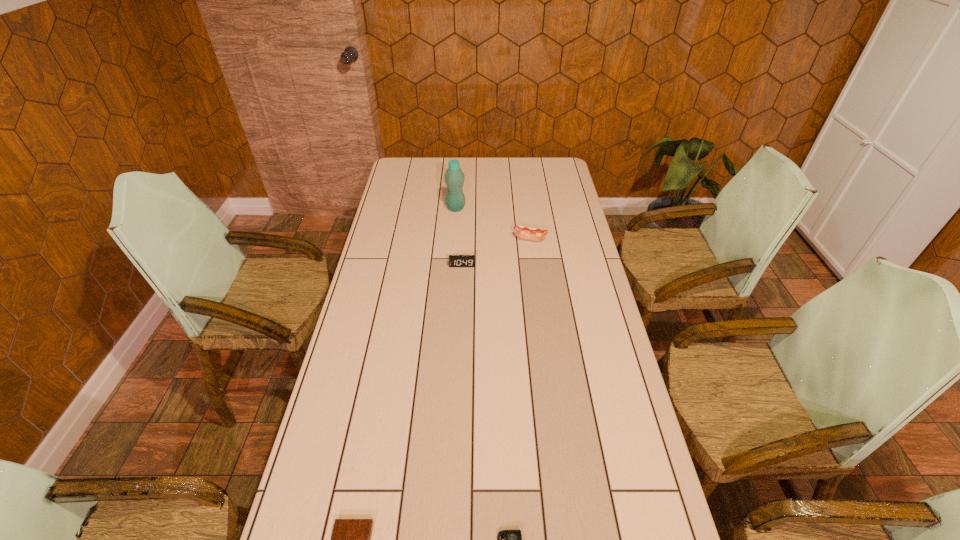
You are a GUI agent. You are given a task and a screenshot of the screen. Output one action in this format:
    pyautogui.click(x=<x>, y=<y>)
    Task: Click on the free space at the far edge
    This screenshot has height=540, width=960.
    Given the screenshot: What is the action you would take?
    pyautogui.click(x=467, y=173)

In the image, there is a desktop. Identify the location of vacant space at the left edge. (391, 237).

In the image, there is a desktop. Where is `vacant space at the right edge`? vacant space at the right edge is located at coordinates (585, 285).

You are a GUI agent. You are given a task and a screenshot of the screen. Output one action in this format:
    pyautogui.click(x=<x>, y=<y>)
    Task: Click on the vacant space at the far left corner of the desktop
    
    Given the screenshot: What is the action you would take?
    pyautogui.click(x=408, y=161)

I want to click on vacant region at the far right corner of the desktop, so click(x=562, y=163).

This screenshot has height=540, width=960. In order to click on unoccupied position between the farthest alarm clock and the tallest object in this screenshot , I will do `click(459, 237)`.

What are the coordinates of `free space that is in between the tallest alarm clock and the sausage` in the screenshot? It's located at (496, 252).

Identify the location of free space between the farthest alarm clock and the rightmost object. (496, 252).

Select which object is the fourth closest to the water bottle. Please provide its 2D coordinates. Your answer should be formatted as a tuple, i.e. [(x, y)], where the tuple contains the x and y coordinates of a point satisfying the conditions above.

[(506, 539)]

Locate which object is the third closest to the leftmost object. Please provide its 2D coordinates. Your answer should be formatted as a tuple, i.e. [(x, y)], where the tuple contains the x and y coordinates of a point satisfying the conditions above.

[(521, 232)]